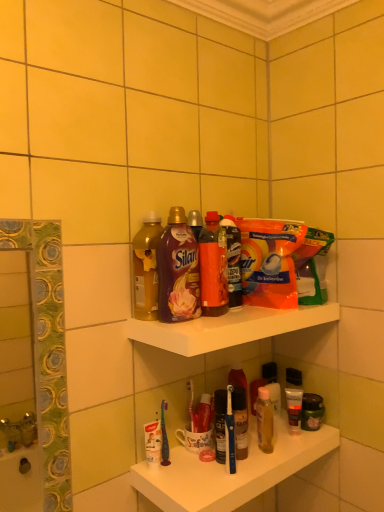
Locate an element on the screen. white plastic toothbrushes at lower center, which is the second shelf in top-to-bottom order is located at coordinates (231, 475).

The width and height of the screenshot is (384, 512). What do you see at coordinates (146, 268) in the screenshot?
I see `matte gold bottle at upper center, positioned as the 1th bottle in left-to-right order` at bounding box center [146, 268].

The width and height of the screenshot is (384, 512). In order to click on orange plastic bag at upper center, the second cleaning product in the left-to-right sequence in this screenshot , I will do tap(269, 261).

Which of these two, matte black tube at lower right or translucent orange bottle at center, which is counted as the 3th bottle, starting from the left, stands taller?

translucent orange bottle at center, which is counted as the 3th bottle, starting from the left.

From a real-world perspective, is matte black tube at lower right on translucent orange bottle at center, the first bottle when ordered from right to left?

No, from a real-world perspective, matte black tube at lower right is not above translucent orange bottle at center, the first bottle when ordered from right to left.

Which point is more distant from viewer, (x=253, y=284) or (x=212, y=327)?

The point (x=253, y=284) is more distant.

From the image's perspective, relative to white glossy shelf at upper center, the first shelf from the top, is orange plastic bag at upper center, the second cleaning product in the left-to-right sequence, above or below?

Based on their image positions, orange plastic bag at upper center, the second cleaning product in the left-to-right sequence, is located above white glossy shelf at upper center, the first shelf from the top.

Is orange plastic bag at upper center, marked as the 1th cleaning product in a right-to-left arrangement, to the left of white glossy shelf at upper center, marked as the 2th shelf in a bottom-to-top arrangement, from the viewer's perspective?

No.

Between translucent plastic bottle at upper center, positioned as the 2th cleaning product in right-to-left order, and matte plastic bottle at upper center, marked as the second bottle in a left-to-right arrangement, which one has more height?

matte plastic bottle at upper center, marked as the second bottle in a left-to-right arrangement.

In the scene shown: Is the surface of translucent plastic bottle at upper center, positioned as the 2th cleaning product in right-to-left order, in direct contact with matte plastic bottle at upper center, which is the 2th bottle in right-to-left order?

No, translucent plastic bottle at upper center, positioned as the 2th cleaning product in right-to-left order, is not with matte plastic bottle at upper center, which is the 2th bottle in right-to-left order.

Considering the relative sizes of translucent plastic bottle at upper center, the 1th cleaning product viewed from the left, and matte plastic bottle at upper center, which is the 2th bottle in right-to-left order, in the image provided, is translucent plastic bottle at upper center, the 1th cleaning product viewed from the left, bigger than matte plastic bottle at upper center, which is the 2th bottle in right-to-left order,?

Actually, translucent plastic bottle at upper center, the 1th cleaning product viewed from the left, might be smaller than matte plastic bottle at upper center, which is the 2th bottle in right-to-left order.

From a real-world perspective, which is physically above, translucent plastic bottle at upper center, the 1th cleaning product viewed from the left, or matte plastic bottle at upper center, which is the 2th bottle in right-to-left order?

From a 3D spatial view, matte plastic bottle at upper center, which is the 2th bottle in right-to-left order, is above.

How different are the orientations of matte black tube at lower right and matte plastic bottle at upper center, which is the 2th bottle in right-to-left order, in degrees?

The angular difference between matte black tube at lower right and matte plastic bottle at upper center, which is the 2th bottle in right-to-left order, is 1.37 degrees.

In the scene shown: Is matte black tube at lower right completely or partially outside of matte plastic bottle at upper center, marked as the second bottle in a left-to-right arrangement?

Absolutely, matte black tube at lower right is external to matte plastic bottle at upper center, marked as the second bottle in a left-to-right arrangement.

Is matte black tube at lower right thinner than matte plastic bottle at upper center, which is the 2th bottle in right-to-left order?

Yes.

Based on the photo, from the image's perspective, does matte black tube at lower right appear higher than matte plastic bottle at upper center, which is the 2th bottle in right-to-left order?

No.

Considering the positions of objects orange plastic bag at upper center, the second cleaning product in the left-to-right sequence, and translucent orange bottle at center, the first bottle when ordered from right to left, in the image provided, who is behind, orange plastic bag at upper center, the second cleaning product in the left-to-right sequence, or translucent orange bottle at center, the first bottle when ordered from right to left,?

orange plastic bag at upper center, the second cleaning product in the left-to-right sequence, is further away from the camera.

From the image's perspective, which is above, orange plastic bag at upper center, marked as the 1th cleaning product in a right-to-left arrangement, or translucent orange bottle at center, the first bottle when ordered from right to left?

orange plastic bag at upper center, marked as the 1th cleaning product in a right-to-left arrangement.

Is orange plastic bag at upper center, the second cleaning product in the left-to-right sequence, situated inside translucent orange bottle at center, the first bottle when ordered from right to left, or outside?

orange plastic bag at upper center, the second cleaning product in the left-to-right sequence, is outside translucent orange bottle at center, the first bottle when ordered from right to left.

Who is smaller, orange plastic bag at upper center, the second cleaning product in the left-to-right sequence, or translucent orange bottle at center, the first bottle when ordered from right to left?

translucent orange bottle at center, the first bottle when ordered from right to left, is smaller.

Considering the sizes of objects orange plastic bag at upper center, marked as the 1th cleaning product in a right-to-left arrangement, and matte black tube at lower right in the image provided, who is taller, orange plastic bag at upper center, marked as the 1th cleaning product in a right-to-left arrangement, or matte black tube at lower right?

Standing taller between the two is orange plastic bag at upper center, marked as the 1th cleaning product in a right-to-left arrangement.

What's the angular difference between orange plastic bag at upper center, the second cleaning product in the left-to-right sequence, and matte black tube at lower right's facing directions?

The angle between the facing direction of orange plastic bag at upper center, the second cleaning product in the left-to-right sequence, and the facing direction of matte black tube at lower right is 1.37 degrees.

Is orange plastic bag at upper center, marked as the 1th cleaning product in a right-to-left arrangement, oriented away from matte black tube at lower right?

No, orange plastic bag at upper center, marked as the 1th cleaning product in a right-to-left arrangement, is not facing the opposite direction of matte black tube at lower right.

Which object is thinner, orange plastic bag at upper center, marked as the 1th cleaning product in a right-to-left arrangement, or matte black tube at lower right?

Result: With smaller width is matte black tube at lower right.

Consider the image. What's the angular difference between matte gold bottle at upper center, which ranks as the 3th bottle in right-to-left order, and matte plastic bottle at upper center, which is the 2th bottle in right-to-left order,'s facing directions?

There is a 4.53e-05-degree angle between the facing directions of matte gold bottle at upper center, which ranks as the 3th bottle in right-to-left order, and matte plastic bottle at upper center, which is the 2th bottle in right-to-left order.

Is matte gold bottle at upper center, which ranks as the 3th bottle in right-to-left order, next to matte plastic bottle at upper center, marked as the second bottle in a left-to-right arrangement, and touching it?

Indeed, matte gold bottle at upper center, which ranks as the 3th bottle in right-to-left order, and matte plastic bottle at upper center, marked as the second bottle in a left-to-right arrangement, are beside each other and touching.

Looking at this image, which of these two, matte gold bottle at upper center, positioned as the 1th bottle in left-to-right order, or matte plastic bottle at upper center, which is the 2th bottle in right-to-left order, is wider?

With larger width is matte gold bottle at upper center, positioned as the 1th bottle in left-to-right order.

Does point (135, 289) appear closer or farther from the camera than point (195, 248)?

Point (135, 289).

Starting from the matte black tube at lower right, which bottle is the 1st one to the left? Please provide its 2D coordinates.

[(213, 267)]

At what (x,y) coordinates should I click in order to perform the action: click on the 2nd shelf in front of the orange plastic bag at upper center, the second cleaning product in the left-to-right sequence. Please return your answer as a coordinate pair (x, y). Image resolution: width=384 pixels, height=512 pixels. Looking at the image, I should click on (228, 328).

Looking at the image, which one is located closer to white plastic toothbrushes at lower center, the first shelf in the bottom-to-top sequence, matte black tube at lower right or matte gold bottle at upper center, positioned as the 1th bottle in left-to-right order?

matte black tube at lower right lies closer to white plastic toothbrushes at lower center, the first shelf in the bottom-to-top sequence, than the other object.

From the image, which object appears to be farther from white glossy shelf at upper center, the first shelf from the top, matte gold bottle at upper center, positioned as the 1th bottle in left-to-right order, or matte plastic bottle at upper center, marked as the second bottle in a left-to-right arrangement?

matte gold bottle at upper center, positioned as the 1th bottle in left-to-right order, is further to white glossy shelf at upper center, the first shelf from the top.

Based on the photo, estimate the real-world distances between objects in this image. Which object is further from matte plastic bottle at upper center, marked as the second bottle in a left-to-right arrangement, white plastic toothbrushes at lower center, which is the second shelf in top-to-bottom order, or translucent plastic bottle at upper center, the 1th cleaning product viewed from the left?

white plastic toothbrushes at lower center, which is the second shelf in top-to-bottom order, is further to matte plastic bottle at upper center, marked as the second bottle in a left-to-right arrangement.

When comparing their distances from matte plastic bottle at upper center, marked as the second bottle in a left-to-right arrangement, does white plastic toothbrushes at lower center, the first shelf in the bottom-to-top sequence, or translucent orange bottle at center, the first bottle when ordered from right to left, seem closer?

translucent orange bottle at center, the first bottle when ordered from right to left, lies closer to matte plastic bottle at upper center, marked as the second bottle in a left-to-right arrangement, than the other object.

Estimate the real-world distances between objects in this image. Which object is further from orange plastic bag at upper center, marked as the 1th cleaning product in a right-to-left arrangement, white plastic toothbrushes at lower center, the first shelf in the bottom-to-top sequence, or white glossy shelf at upper center, the first shelf from the top?

Based on the image, white plastic toothbrushes at lower center, the first shelf in the bottom-to-top sequence, appears to be further to orange plastic bag at upper center, marked as the 1th cleaning product in a right-to-left arrangement.

Based on their spatial positions, is white plastic toothbrushes at lower center, which is the second shelf in top-to-bottom order, or matte plastic bottle at upper center, which is the 2th bottle in right-to-left order, further from translucent plastic bottle at upper center, positioned as the 2th cleaning product in right-to-left order?

Based on the image, white plastic toothbrushes at lower center, which is the second shelf in top-to-bottom order, appears to be further to translucent plastic bottle at upper center, positioned as the 2th cleaning product in right-to-left order.

Looking at the image, which one is located closer to translucent orange bottle at center, which is counted as the 3th bottle, starting from the left, matte black tube at lower right or matte plastic bottle at upper center, marked as the second bottle in a left-to-right arrangement?

Based on the image, matte plastic bottle at upper center, marked as the second bottle in a left-to-right arrangement, appears to be nearer to translucent orange bottle at center, which is counted as the 3th bottle, starting from the left.

Based on their spatial positions, is translucent orange bottle at center, which is counted as the 3th bottle, starting from the left, or translucent plastic bottle at upper center, the 1th cleaning product viewed from the left, closer to orange plastic bag at upper center, marked as the 1th cleaning product in a right-to-left arrangement?

translucent plastic bottle at upper center, the 1th cleaning product viewed from the left, is positioned closer to the anchor orange plastic bag at upper center, marked as the 1th cleaning product in a right-to-left arrangement.

Identify the location of cleaning product located between white glossy shelf at upper center, the first shelf from the top, and translucent plastic bottle at upper center, the 1th cleaning product viewed from the left, in the depth direction. (269, 261).

Locate an element on the screen. The width and height of the screenshot is (384, 512). shelf between translucent orange bottle at center, which is counted as the 3th bottle, starting from the left, and white plastic toothbrushes at lower center, which is the second shelf in top-to-bottom order, in the vertical direction is located at coordinates (228, 328).

In order to click on cleaning product between matte gold bottle at upper center, which ranks as the 3th bottle in right-to-left order, and white glossy shelf at upper center, the first shelf from the top in this screenshot , I will do `click(233, 260)`.

Locate an element on the screen. This screenshot has width=384, height=512. shelf that lies between orange plastic bag at upper center, marked as the 1th cleaning product in a right-to-left arrangement, and white plastic toothbrushes at lower center, which is the second shelf in top-to-bottom order, from top to bottom is located at coordinates (228, 328).